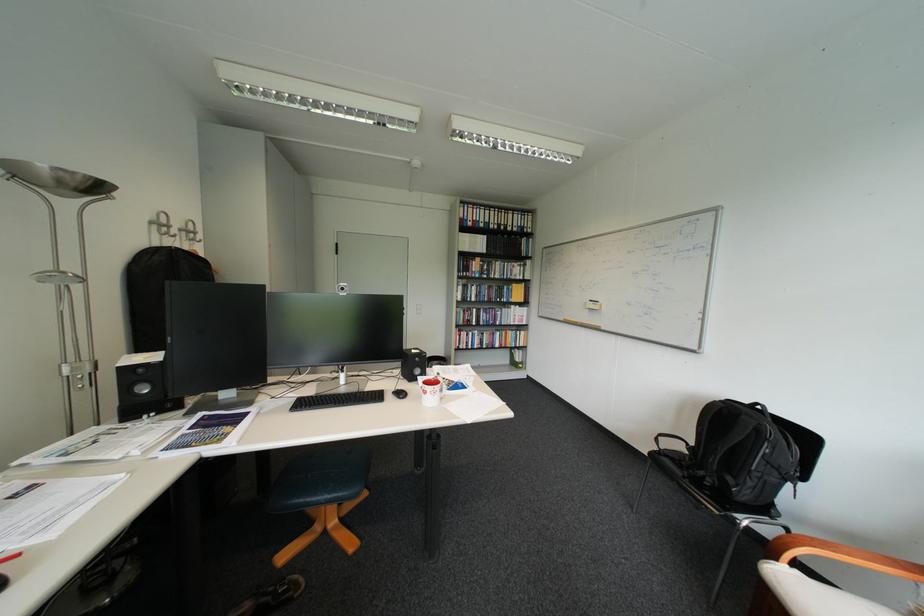
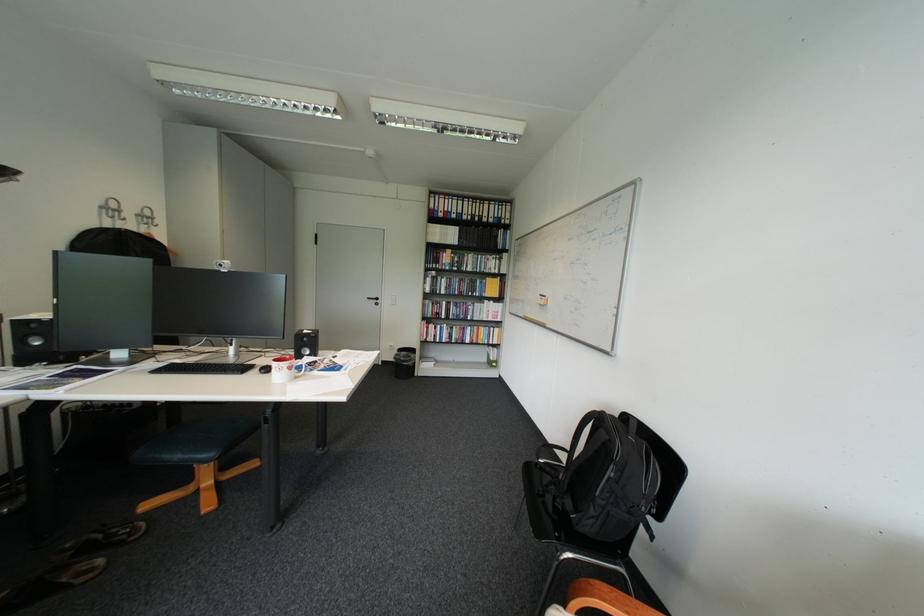
Locate, in the second image, the point that corresponds to point 159,392 in the first image.

(51, 344)